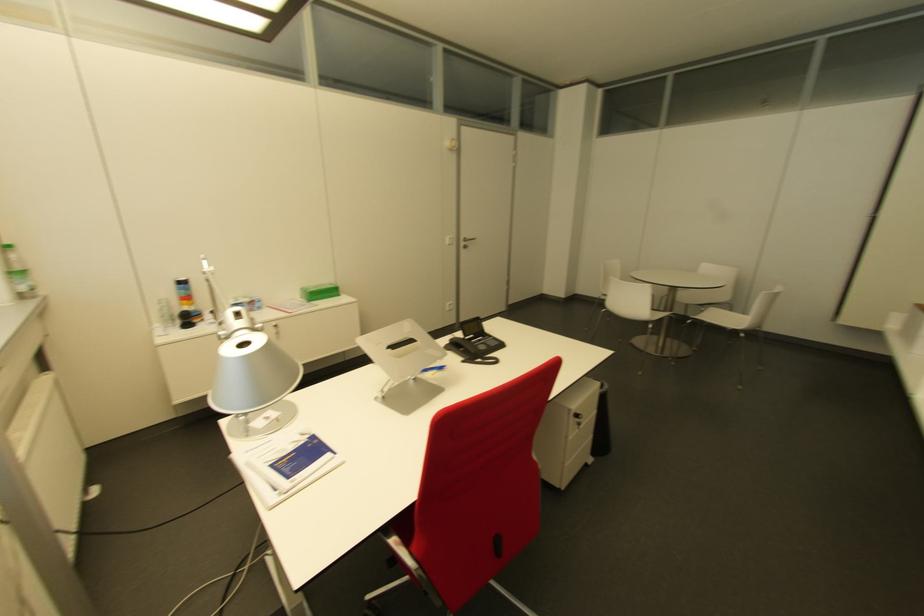
This screenshot has height=616, width=924. I want to click on black phone receiver, so (x=464, y=347).